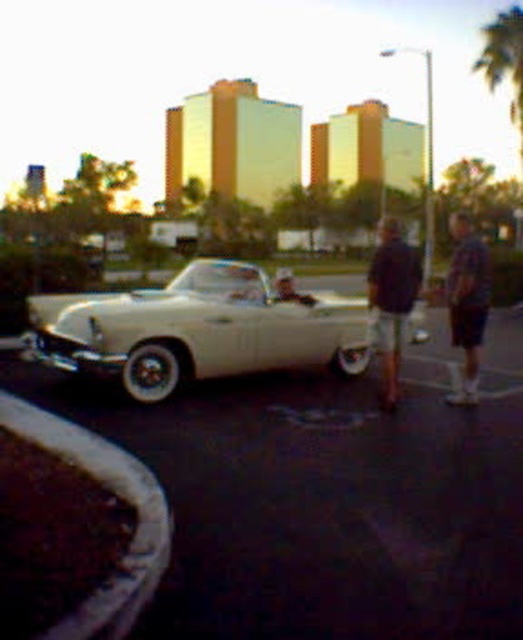
You are standing in front of the vintage white convertible car. There are two points marked on the car. One is at coordinate point (442, 464) and the other is at point (281, 323). Which point is closer to you?

Point (442, 464) is closer to the camera than point (281, 323).

You are a photographer trying to capture the matte black car at center and the blue denim shorts at right in a single frame. Based on their sizes, which object should appear larger in the photo?

The blue denim shorts at right should appear larger in the photo since they are taller than the matte black car at center.

You are a photographer trying to capture a photo of the matte black car at center without including the blue denim shorts at right in the frame. Based on their positions, which direction should you move to the left or right to ensure the shorts are out of the shot?

Since the blue denim shorts at right are to the right of the matte black car at center, moving to the left would position the car further to the right in your frame, potentially excluding the shorts. Alternatively, moving to the right might bring the shorts closer, so left is the better choice.